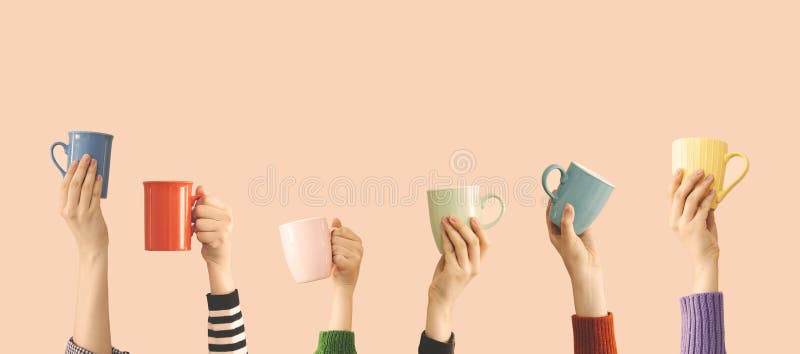
The width and height of the screenshot is (800, 354). Identify the location of mug handle. (58, 145), (197, 198), (330, 230), (497, 202), (553, 168), (730, 156).